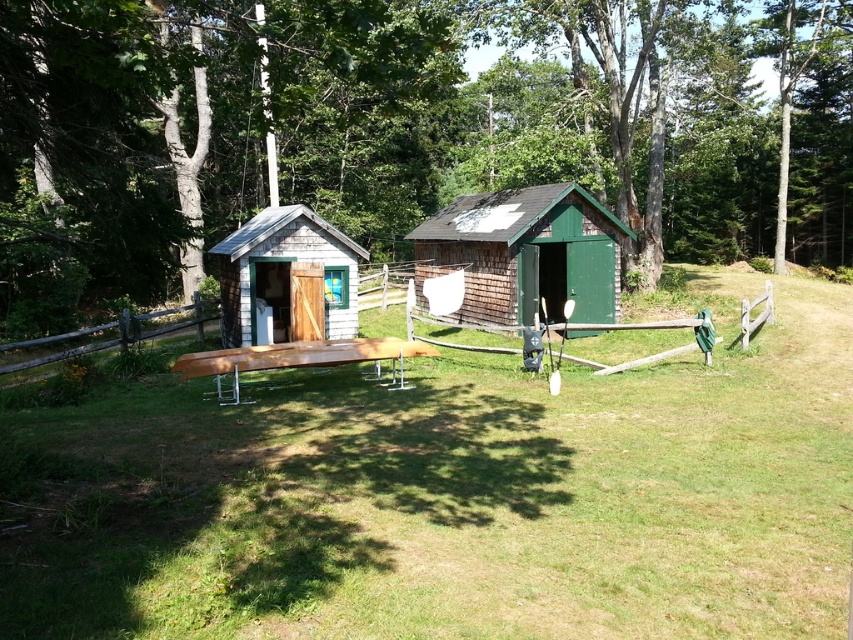
Is green wood tree at upper center smaller than wooden at center?

No.

Which of these two, green wood tree at upper center or wooden at center, stands shorter?

wooden at center is shorter.

This screenshot has width=853, height=640. What do you see at coordinates (407, 131) in the screenshot?
I see `green wood tree at upper center` at bounding box center [407, 131].

You are a GUI agent. You are given a task and a screenshot of the screen. Output one action in this format:
    pyautogui.click(x=<x>, y=<y>)
    Task: Click on the green wood tree at upper center
    The height and width of the screenshot is (640, 853).
    Given the screenshot: What is the action you would take?
    pyautogui.click(x=407, y=131)

Can you confirm if green shingled cabin at center is smaller than wooden at center?

Correct, green shingled cabin at center occupies less space than wooden at center.

Is green shingled cabin at center further to the viewer compared to wooden at center?

Yes, green shingled cabin at center is further from the viewer.

Is point (491, 211) closer to camera compared to point (4, 348)?

No.

Find the location of a particular element. The image size is (853, 640). green shingled cabin at center is located at coordinates (x=524, y=253).

Based on the photo, can you confirm if green wood tree at upper center is taller than light brown wood picnic table at center?

Correct, green wood tree at upper center is much taller as light brown wood picnic table at center.

Between point (839, 164) and point (346, 339), which one is positioned behind?

Positioned behind is point (839, 164).

Between point (540, 74) and point (402, 385), which one is positioned in front?

Point (402, 385) is in front.

The height and width of the screenshot is (640, 853). I want to click on green wood tree at upper center, so click(407, 131).